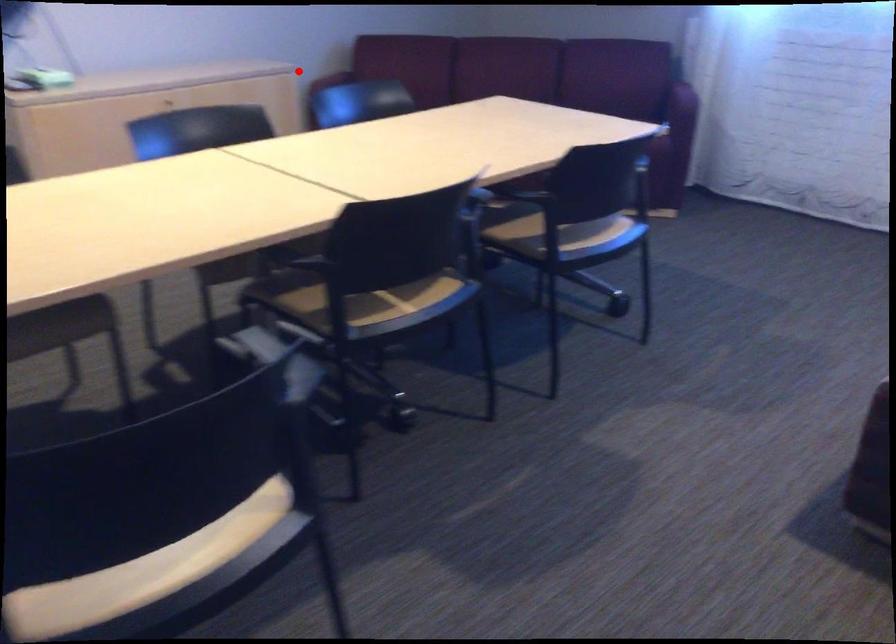
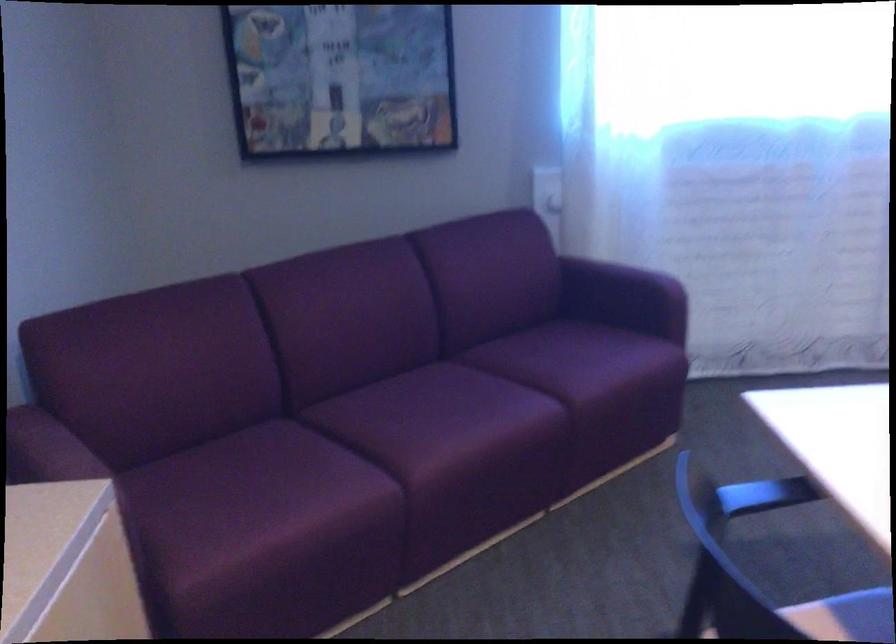
Question: I am providing you with two images of the same scene from different viewpoints. Given a red point in image1, look at the same physical point in image2. Is it:

Choices:
 (A) Closer to the viewpoint
 (B) Farther from the viewpoint

Answer: (A)